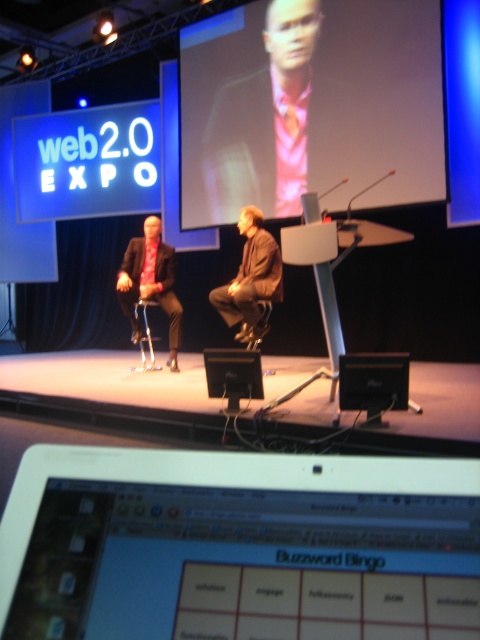
Question: Which object appears farthest from the camera in this image?

Choices:
 (A) black glossy speaker at center
 (B) brown leather jacket at center
 (C) black leather speaker at center
 (D) matte black screen at center

Answer: (B)

Question: Which object appears farthest from the camera in this image?

Choices:
 (A) matte black screen at center
 (B) black leather speaker at center

Answer: (B)

Question: Can you confirm if matte black screen at center is positioned below black glossy speaker at center?

Choices:
 (A) yes
 (B) no

Answer: (B)

Question: Considering the real-world distances, which object is closest to the black leather speaker at center?

Choices:
 (A) matte black screen at center
 (B) black glossy speaker at center
 (C) pink fabric at upper center

Answer: (B)

Question: Can you confirm if matte black screen at center is positioned above black glossy speaker at center?

Choices:
 (A) yes
 (B) no

Answer: (A)

Question: Is pink fabric at upper center bigger than black leather speaker at center?

Choices:
 (A) yes
 (B) no

Answer: (A)